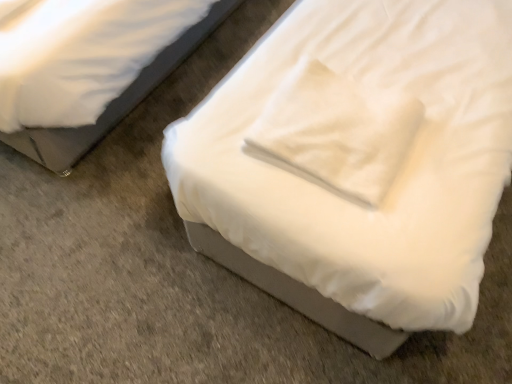
Measure the distance between white soft pillow at center and camera.

white soft pillow at center is 1.04 meters from camera.

This screenshot has width=512, height=384. What do you see at coordinates (335, 132) in the screenshot? I see `white soft pillow at center` at bounding box center [335, 132].

What are the coordinates of `white soft pillow at center` in the screenshot? It's located at (335, 132).

Find the location of `white soft pillow at center`. white soft pillow at center is located at coordinates (335, 132).